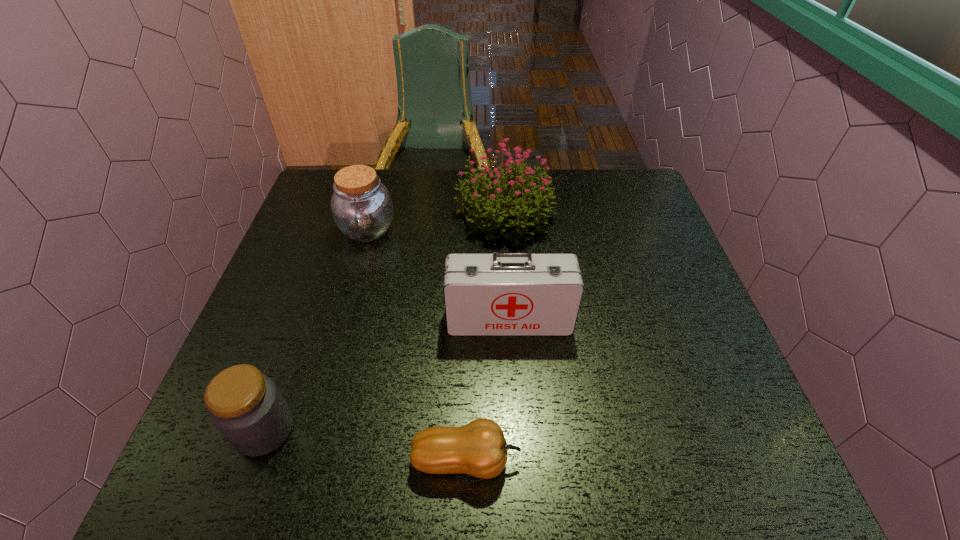
Where is `vacant space that is in between the farther jar and the gourd`? The width and height of the screenshot is (960, 540). vacant space that is in between the farther jar and the gourd is located at coordinates (417, 345).

Identify the location of object that is the fourth nearest to the shortest object. (362, 208).

At what (x,y) coordinates should I click in order to perform the action: click on object that is the second closest to the third farthest object. Please return your answer as a coordinate pair (x, y). The height and width of the screenshot is (540, 960). Looking at the image, I should click on (479, 449).

I want to click on vacant space that satisfies the following two spatial constraints: 1. on the front-facing side of the third farthest object; 2. on the surface of the nearer jar near the warning symbol, so click(x=516, y=429).